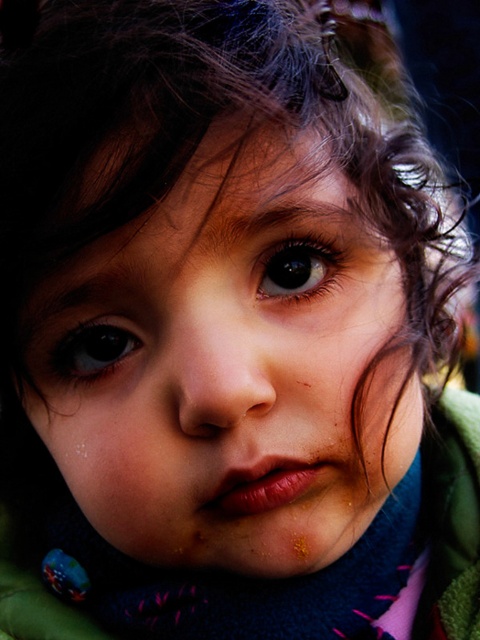
Question: Which of the following is the farthest from the observer?

Choices:
 (A) (302, 237)
 (B) (84, 492)
 (C) (117, 330)

Answer: (B)

Question: Does brown glossy eye at center appear over brown glossy eye at upper center?

Choices:
 (A) no
 (B) yes

Answer: (A)

Question: Considering the real-world distances, which object is farthest from the matte blue scarf at center?

Choices:
 (A) brown glossy eye at upper center
 (B) brown glossy eye at center

Answer: (B)

Question: Can you confirm if matte blue scarf at center is positioned above brown glossy eye at upper center?

Choices:
 (A) yes
 (B) no

Answer: (B)

Question: Is matte blue scarf at center smaller than brown glossy eye at upper center?

Choices:
 (A) yes
 (B) no

Answer: (B)

Question: Which of the following is the closest to the observer?

Choices:
 (A) (308, 236)
 (B) (167, 436)
 (C) (83, 368)

Answer: (B)